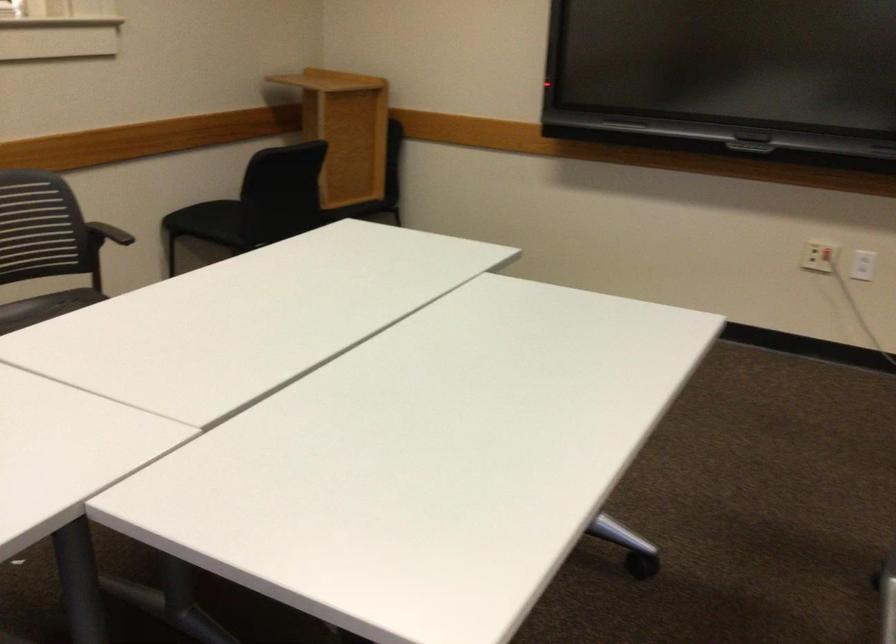
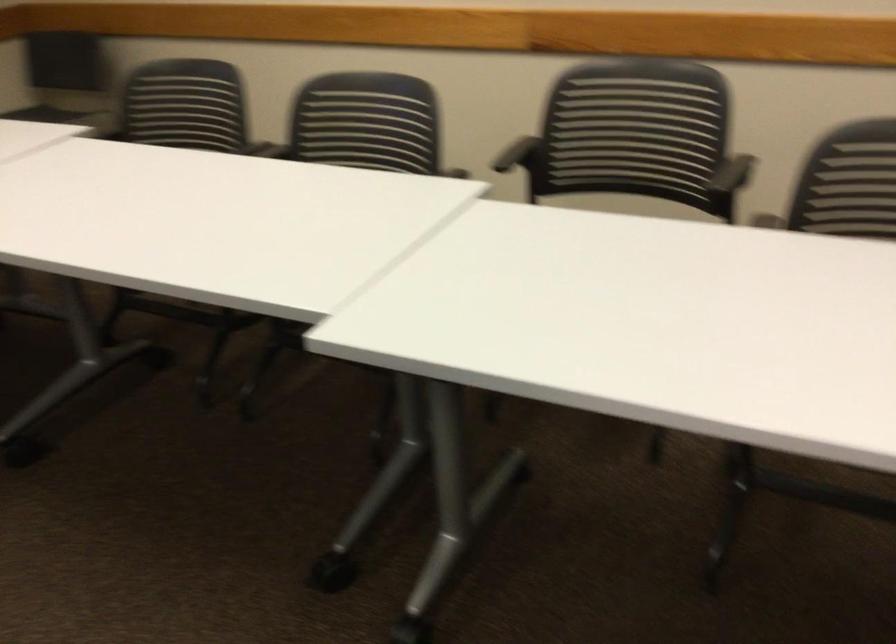
The images are taken continuously from a first-person perspective. In which direction is your viewpoint rotating?

The rotation direction of the camera is left-down.